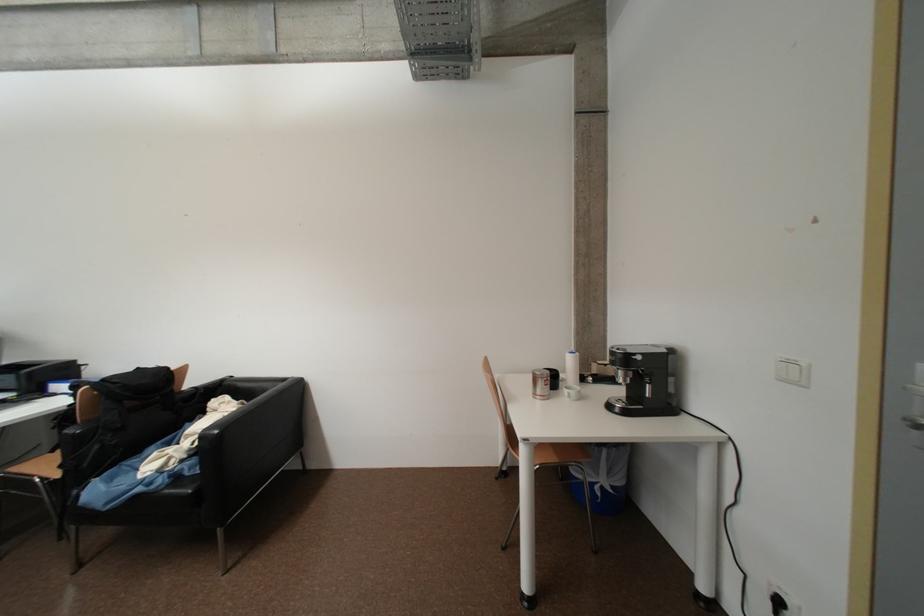
Where would you lift the white espresso cup? Please return your answer as a coordinate pair (x, y).

(572, 392)